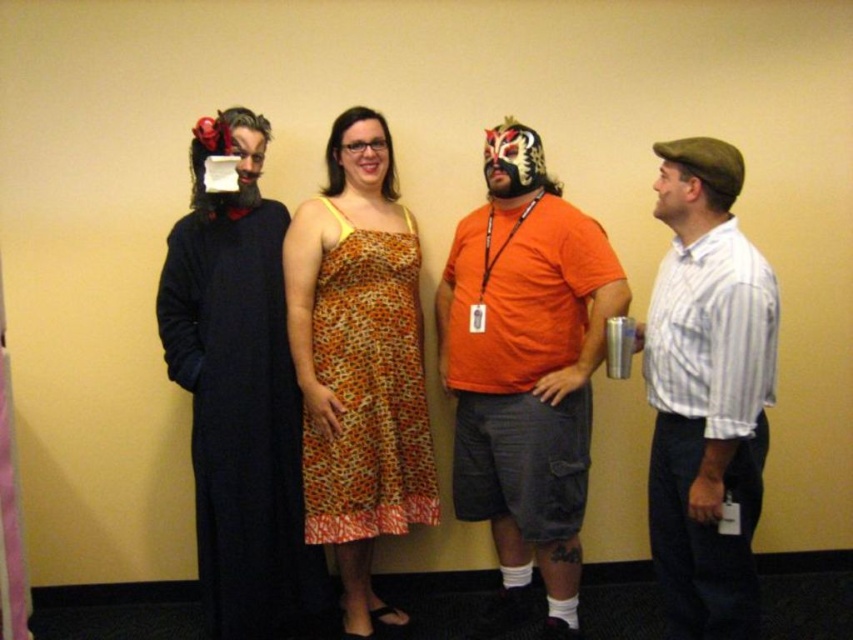
Who is taller, velvet black robe at left or orange printed fabric dress at center?

Standing taller between the two is velvet black robe at left.

Which is more to the right, velvet black robe at left or orange printed fabric dress at center?

orange printed fabric dress at center is more to the right.

Measure the distance between point (282,481) and camera.

Point (282,481) is 2.56 meters away from camera.

This screenshot has height=640, width=853. Find the location of `velvet black robe at left`. velvet black robe at left is located at coordinates (241, 396).

Is the position of orange cotton shirt at center more distant than that of velvet black robe at left?

That is True.

Does orange cotton shirt at center have a smaller size compared to velvet black robe at left?

Actually, orange cotton shirt at center might be larger than velvet black robe at left.

Locate an element on the screen. orange cotton shirt at center is located at coordinates (525, 371).

At what (x,y) coordinates should I click in order to perform the action: click on orange cotton shirt at center. Please return your answer as a coordinate pair (x, y). Looking at the image, I should click on (525, 371).

Who is positioned more to the left, orange cotton shirt at center or orange printed fabric dress at center?

orange printed fabric dress at center is more to the left.

What do you see at coordinates (525, 371) in the screenshot?
I see `orange cotton shirt at center` at bounding box center [525, 371].

Does point (546, 563) come closer to viewer compared to point (410, 506)?

Yes.

At what (x,y) coordinates should I click in order to perform the action: click on orange cotton shirt at center. Please return your answer as a coordinate pair (x, y). Looking at the image, I should click on (525, 371).